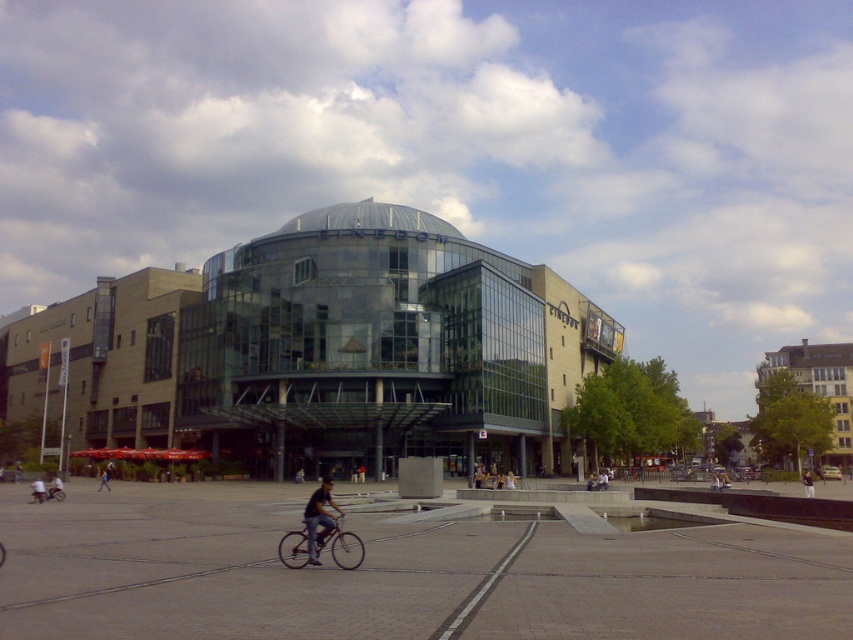
You are a delivery person with a cart that is 1.2 meters wide. You need to pass through the space between the metallic silver bicycle at center and the dark blue jeans at lower left. Can your cart fit through the space?

The metallic silver bicycle at center is narrower than the dark blue jeans at lower left, so the space between them might be sufficient. However, without knowing the exact distance between the objects, it is uncertain if the 1.2 meter wide cart can fit through the space.

You are standing at the entrance of the cinema building and want to find the metallic silver bicycle at center. According to the coordinates, where should you look in relation to the cinema building?

The metallic silver bicycle at center is located at coordinates point (340, 545), which means it is positioned to the right and slightly forward from the cinema building entrance.